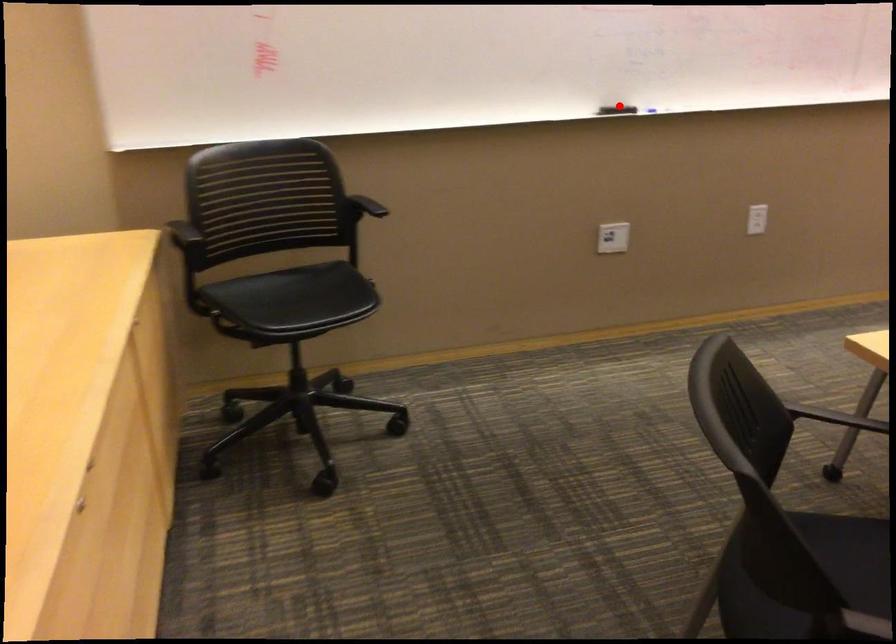
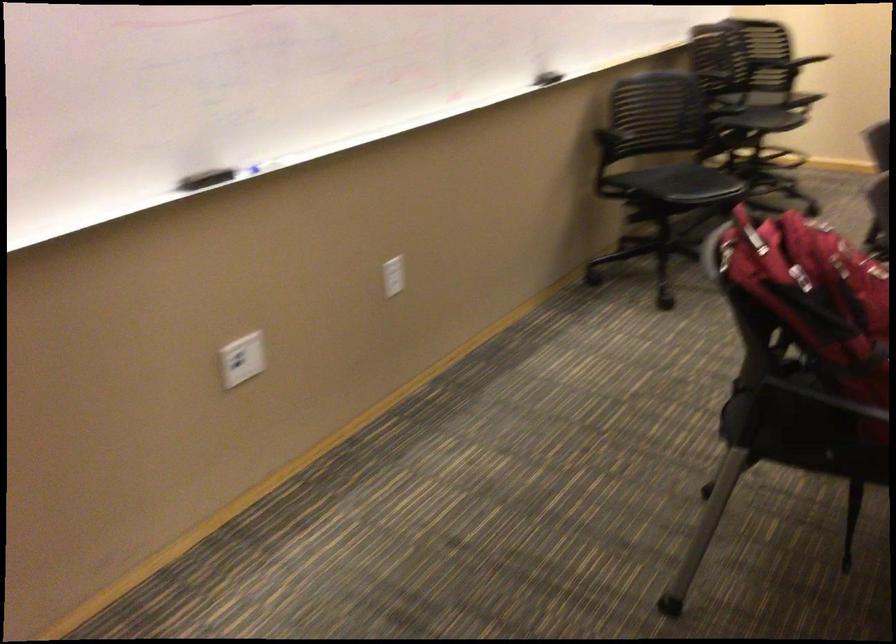
Question: I am providing you with two images of the same scene from different viewpoints. Given a red point in image1, look at the same physical point in image2. Is it:

Choices:
 (A) Closer to the viewpoint
 (B) Farther from the viewpoint

Answer: (A)